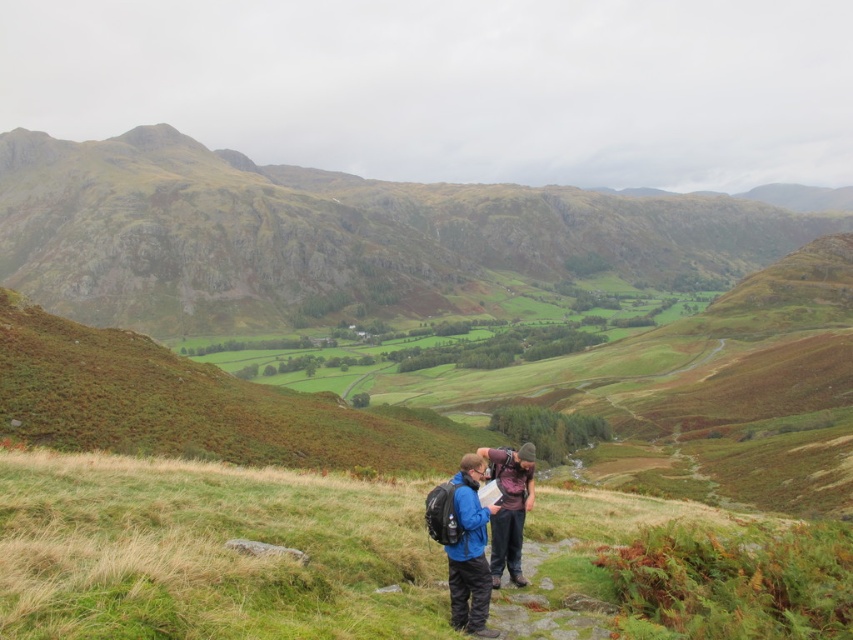
Is green grassy at center bigger than blue fabric backpack at center?

Yes.

Describe the element at coordinates (210, 552) in the screenshot. The height and width of the screenshot is (640, 853). I see `green grassy at center` at that location.

This screenshot has width=853, height=640. Identify the location of green grassy at center. (210, 552).

Is blue fabric backpack at center further to the viewer compared to matte purple shirt at center?

That is False.

Locate an element on the screen. The height and width of the screenshot is (640, 853). blue fabric backpack at center is located at coordinates (465, 541).

Does point (299, 179) lie in front of point (512, 580)?

No.

Can you confirm if rugged stone mountain at center is thinner than matte purple shirt at center?

In fact, rugged stone mountain at center might be wider than matte purple shirt at center.

Locate an element on the screen. rugged stone mountain at center is located at coordinates (328, 234).